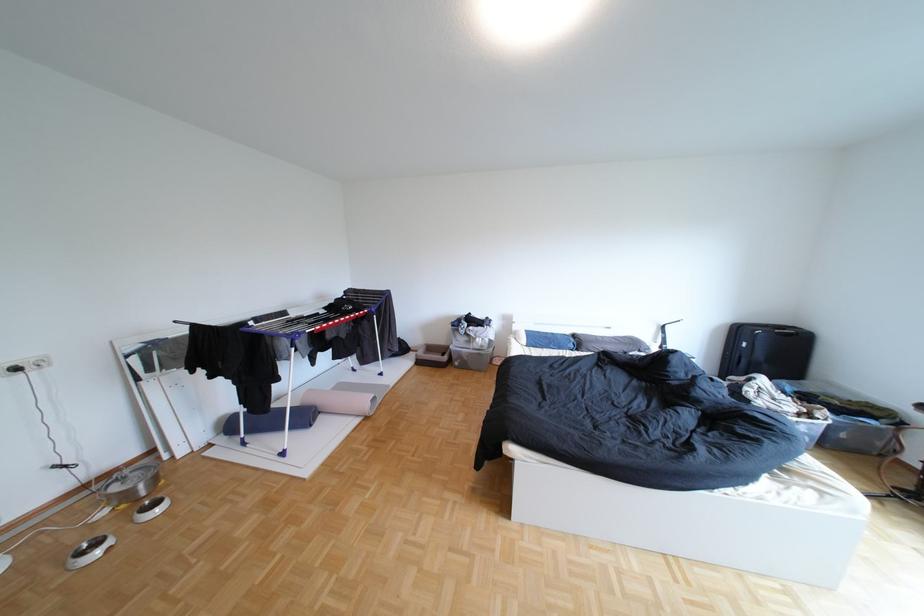
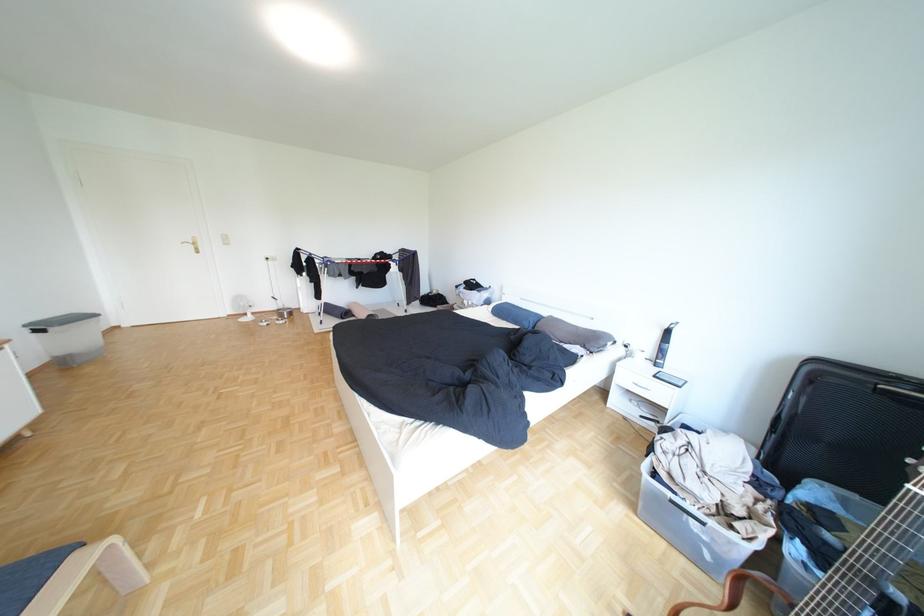
Where in the second image is the point corresponding to pixel 655 351 from the first image?

(600, 347)